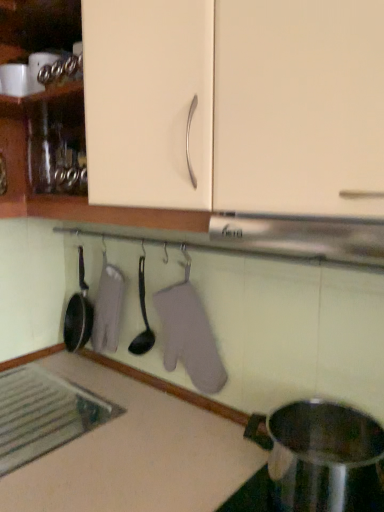
Question: Considering the positions of gray fabric oven mitt at center and matte cream cabinet at upper center in the image, is gray fabric oven mitt at center taller or shorter than matte cream cabinet at upper center?

Choices:
 (A) short
 (B) tall

Answer: (A)

Question: From a real-world perspective, relative to matte cream cabinet at upper center, is gray fabric oven mitt at center vertically above or below?

Choices:
 (A) below
 (B) above

Answer: (A)

Question: Which is farther from the white matte countertop at lower left?

Choices:
 (A) black plastic spoon at center
 (B) gray fabric oven mitt at center
 (C) matte cream cabinet at upper center
 (D) stainless steel pot at lower right

Answer: (C)

Question: Estimate the real-world distances between objects in this image. Which object is farther from the black plastic spoon at center?

Choices:
 (A) matte cream cabinet at upper center
 (B) stainless steel pot at lower right
 (C) white matte countertop at lower left
 (D) gray fabric oven mitt at center

Answer: (A)